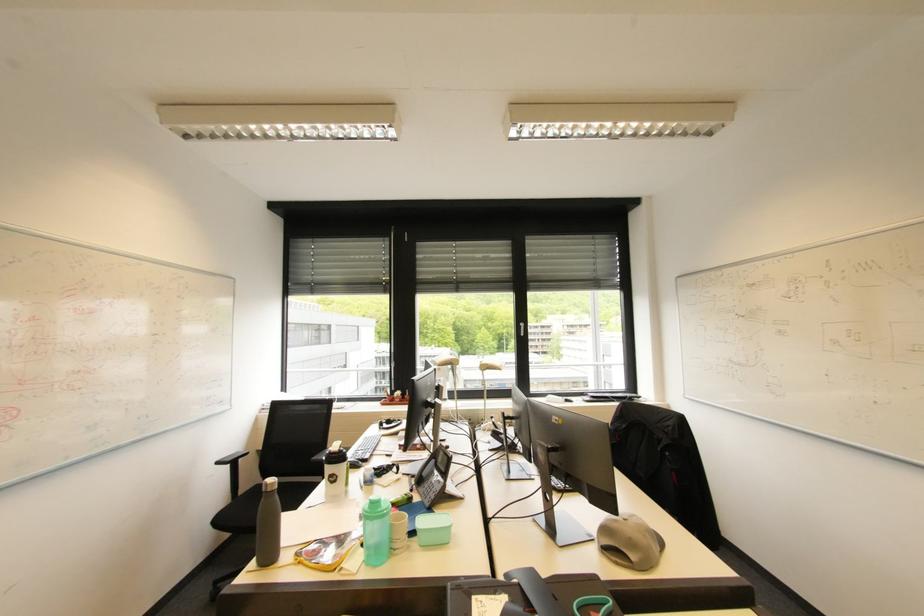
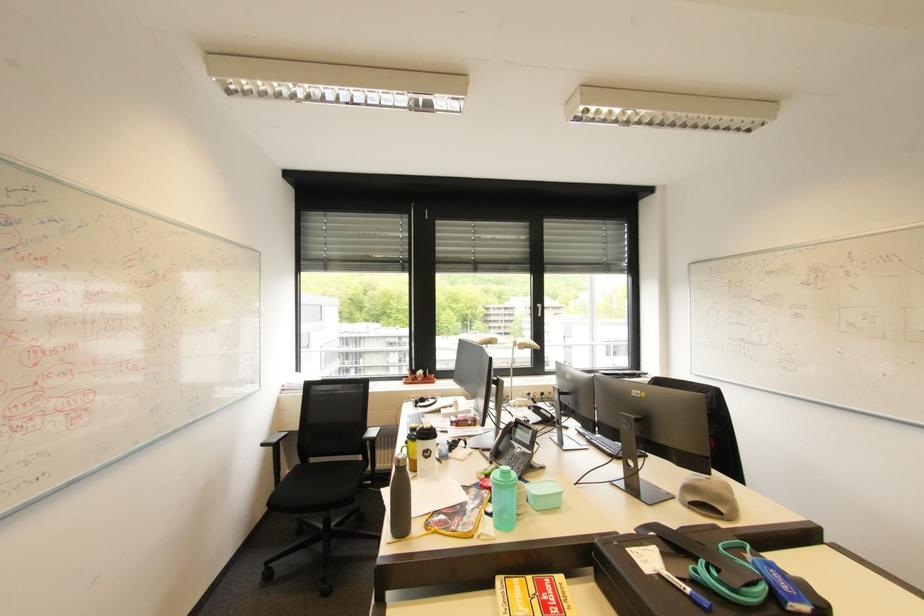
Where in the second image is the point corresponding to [272,485] from the first image?

(405, 461)